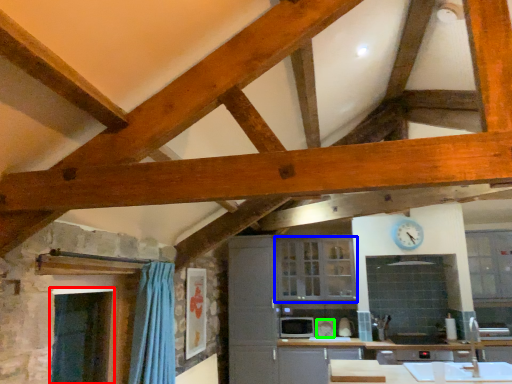
Question: Considering the real-world distances, which object is closest to window screen (highlighted by a red box)? cabinetry (highlighted by a blue box) or appliance (highlighted by a green box).

Choices:
 (A) cabinetry
 (B) appliance

Answer: (A)